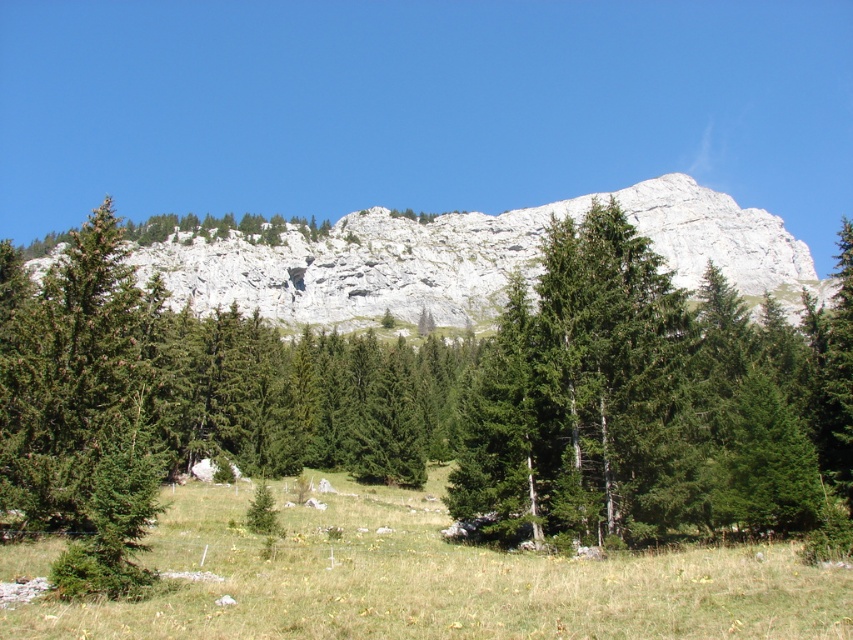
Is green grassy field at lower center below white rocky mountain at upper center?

Correct, green grassy field at lower center is located below white rocky mountain at upper center.

Who is positioned more to the right, green grassy field at lower center or white rocky mountain at upper center?

Positioned to the right is white rocky mountain at upper center.

Describe the element at coordinates (434, 579) in the screenshot. I see `green grassy field at lower center` at that location.

This screenshot has width=853, height=640. What are the coordinates of `green grassy field at lower center` in the screenshot? It's located at (434, 579).